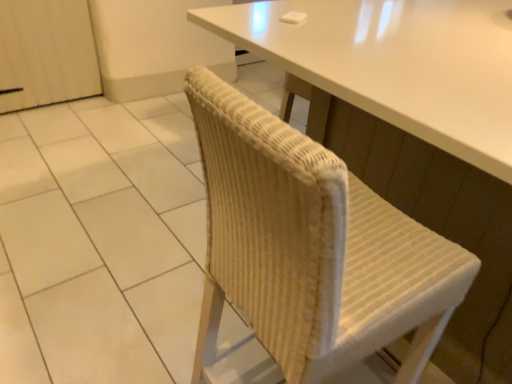
From the picture: What is the approximate width of woven beige chair at center?

woven beige chair at center is 1.23 meters wide.

This screenshot has height=384, width=512. What are the coordinates of `woven beige chair at center` in the screenshot? It's located at (314, 244).

The image size is (512, 384). Describe the element at coordinates (314, 244) in the screenshot. I see `woven beige chair at center` at that location.

What are the coordinates of `woven beige chair at center` in the screenshot? It's located at (314, 244).